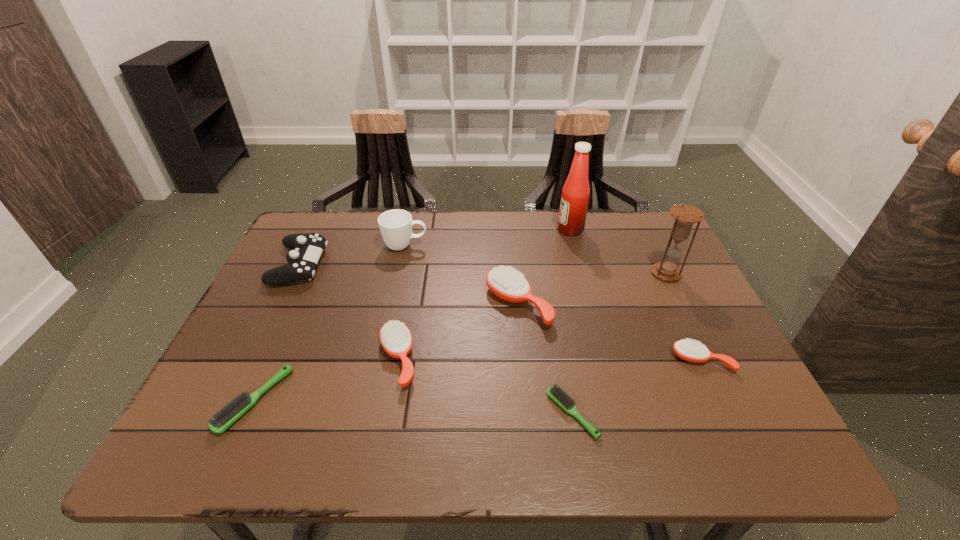
Image resolution: width=960 pixels, height=540 pixels. In order to click on free space at the far right corner in this screenshot , I will do point(619,227).

At what (x,y) coordinates should I click in order to perform the action: click on vacant space that is in between the condiment and the brown hourglass. Please return your answer as a coordinate pair (x, y). The image size is (960, 540). Looking at the image, I should click on (618, 252).

Locate an element on the screen. The height and width of the screenshot is (540, 960). vacant area that lies between the biggest orange hairbrush and the smallest orange hairbrush is located at coordinates (610, 332).

Identify the location of free point between the eighth shortest object and the left light hairbrush. (461, 337).

At what (x,y) coordinates should I click in order to perform the action: click on free spot between the shortest object and the black control. Please return your answer as a coordinate pair (x, y). Looking at the image, I should click on click(x=436, y=340).

Where is `free area in between the smallest orange hairbrush and the shortest object`? The width and height of the screenshot is (960, 540). free area in between the smallest orange hairbrush and the shortest object is located at coordinates (637, 387).

Locate an element on the screen. free space between the fourth shortest hairbrush and the red condiment is located at coordinates (484, 294).

Identify the location of empty location between the black control and the brown hourglass. (483, 269).

Where is `blank region between the fourth shortest hairbrush and the black control`? blank region between the fourth shortest hairbrush and the black control is located at coordinates (348, 312).

This screenshot has height=540, width=960. Identify the location of vacant space that is in between the control and the shortest object. (436, 340).